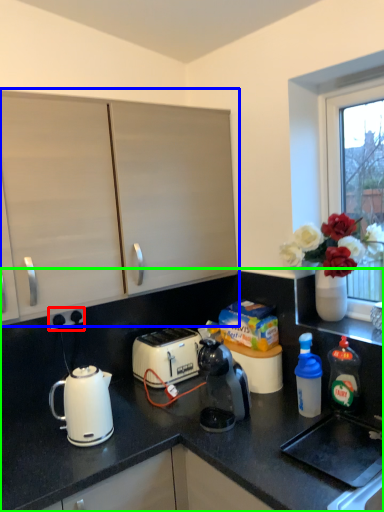
Question: Estimate the real-world distances between objects in this image. Which object is closer to electric outlet (highlighted by a red box), cabinetry (highlighted by a blue box) or countertop (highlighted by a green box)?

Choices:
 (A) cabinetry
 (B) countertop

Answer: (B)